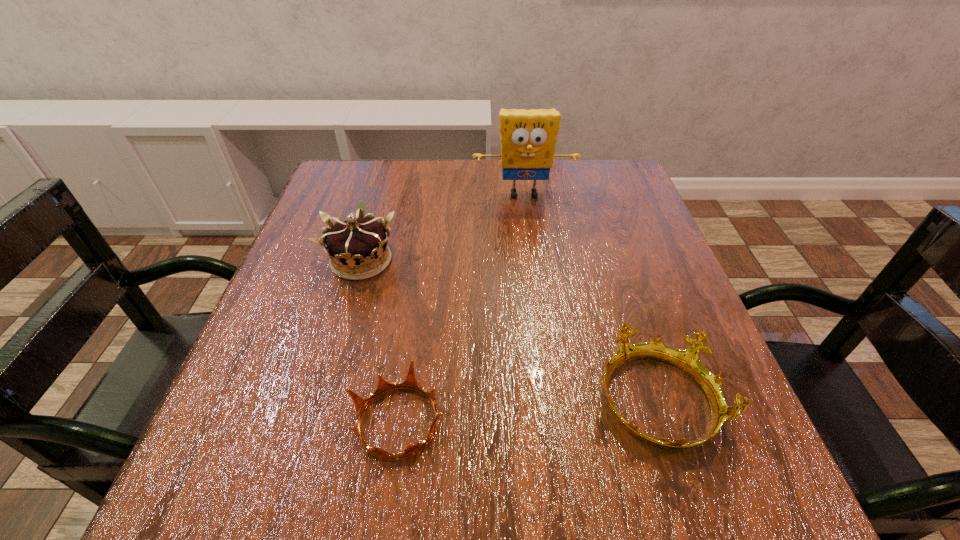
Identify the location of the tallest object. Image resolution: width=960 pixels, height=540 pixels. click(528, 137).

In order to click on sponge in this screenshot , I will do `click(528, 137)`.

The height and width of the screenshot is (540, 960). What are the coordinates of `the second farthest object` in the screenshot? It's located at (358, 249).

The width and height of the screenshot is (960, 540). I want to click on the tallest crown, so click(358, 249).

Find the location of a particular element. The width and height of the screenshot is (960, 540). the third tallest object is located at coordinates (687, 360).

You are a GUI agent. You are given a task and a screenshot of the screen. Output one action in this format:
    pyautogui.click(x=<x>, y=<y>)
    Task: Click on the rightmost crown
    The image size is (960, 540).
    Given the screenshot: What is the action you would take?
    pyautogui.click(x=687, y=360)

The image size is (960, 540). Find the location of `the shortest crown`. the shortest crown is located at coordinates (410, 382).

Locate an element on the screen. Image resolution: width=960 pixels, height=540 pixels. vacant area located on the face of the farthest object is located at coordinates (542, 337).

Find the location of `vacant space located on the back of the third nearest object`. vacant space located on the back of the third nearest object is located at coordinates (384, 184).

At what (x,y) coordinates should I click in order to perform the action: click on free region located 0.200m on the left of the rightmost crown. Please return your answer as a coordinate pair (x, y). Image resolution: width=960 pixels, height=540 pixels. Looking at the image, I should click on (465, 402).